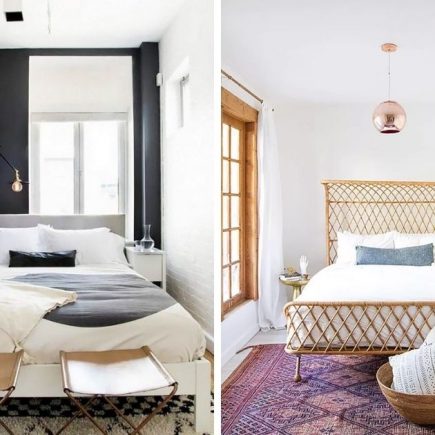
Find the location of `white end table`. white end table is located at coordinates (151, 268).